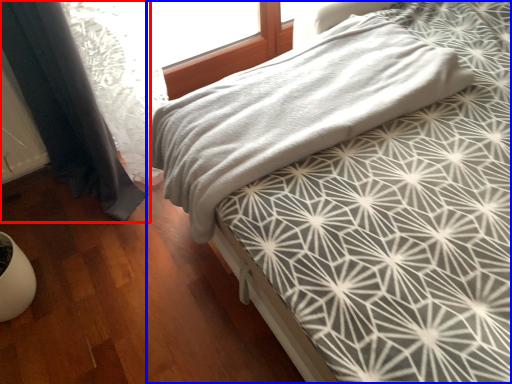
Question: Among these objects, which one is nearest to the camera, curtain (highlighted by a red box) or bed (highlighted by a blue box)?

Choices:
 (A) curtain
 (B) bed

Answer: (A)